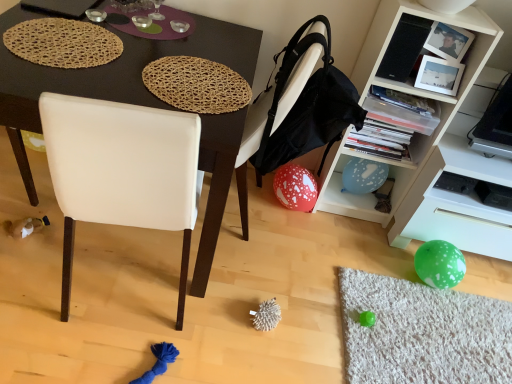
Question: Does white leather chair at center have a lesser height compared to white plastic shelf at lower right?

Choices:
 (A) no
 (B) yes

Answer: (A)

Question: Is white plastic shelf at lower right inside white leather chair at center?

Choices:
 (A) no
 (B) yes

Answer: (A)

Question: Is white leather chair at center next to white plastic shelf at lower right?

Choices:
 (A) yes
 (B) no

Answer: (B)

Question: Can you confirm if white leather chair at center is taller than white plastic shelf at lower right?

Choices:
 (A) yes
 (B) no

Answer: (A)

Question: Would you consider white leather chair at center to be distant from white plastic shelf at lower right?

Choices:
 (A) no
 (B) yes

Answer: (A)

Question: Considering the positions of red dotted balloon at lower center and white plastic shelf at lower right in the image, is red dotted balloon at lower center bigger or smaller than white plastic shelf at lower right?

Choices:
 (A) big
 (B) small

Answer: (B)

Question: From the image's perspective, is red dotted balloon at lower center above or below white plastic shelf at lower right?

Choices:
 (A) above
 (B) below

Answer: (A)

Question: Is red dotted balloon at lower center wider or thinner than white plastic shelf at lower right?

Choices:
 (A) wide
 (B) thin

Answer: (B)

Question: From a real-world perspective, is red dotted balloon at lower center above or below white plastic shelf at lower right?

Choices:
 (A) above
 (B) below

Answer: (B)

Question: In terms of height, does red dotted balloon at lower center look taller or shorter compared to white matte cabinet at upper right?

Choices:
 (A) tall
 (B) short

Answer: (B)

Question: Is red dotted balloon at lower center wider or thinner than white matte cabinet at upper right?

Choices:
 (A) wide
 (B) thin

Answer: (B)

Question: Is red dotted balloon at lower center spatially inside white matte cabinet at upper right, or outside of it?

Choices:
 (A) inside
 (B) outside

Answer: (B)

Question: In the image, is red dotted balloon at lower center positioned in front of or behind white matte cabinet at upper right?

Choices:
 (A) behind
 (B) front

Answer: (A)

Question: Considering their positions, is matte black desk at center located in front of or behind white plastic shelf at lower right?

Choices:
 (A) behind
 (B) front

Answer: (B)

Question: Does point (233, 160) appear closer or farther from the camera than point (476, 208)?

Choices:
 (A) closer
 (B) farther

Answer: (A)